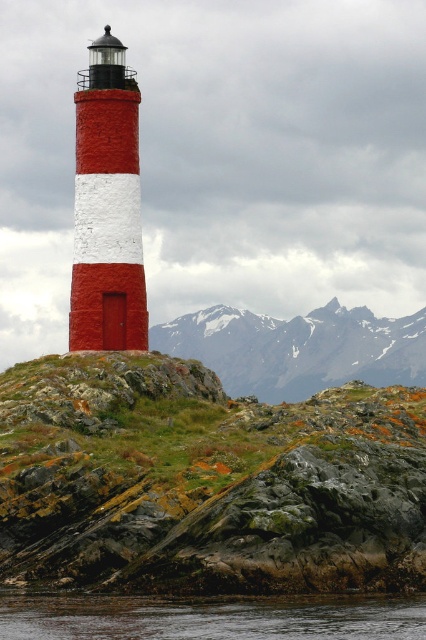
You are standing at the base of the lighthouse and want to place a small weatherproof box on the green mossy rock at center. Given that the coordinates of the rock are point (204, 481), can you confirm if this location is suitable for placing the box?

The green mossy rock at center is represented by point (204, 481), so yes, the location is suitable for placing the box as it is clearly marked in the scene.

In the scene shown: You are a hiker planning to climb the snowy rocky mountain at upper center and then descend to the transparent water at lower center. Which part of the journey will require more physical effort?

Climbing the snowy rocky mountain at upper center will require more physical effort because it has a greater height compared to the transparent water at lower center.

You are standing at the base of the lighthouse looking out towards the rocky terrain. There are two points marked in the scene. The first point is at coordinates point (34,433) and the second is at point (411,632). Which point is closer to your current position?

Point (34,433) is closer to your current position because it is further to the camera than point (411,632), meaning it is physically nearer to the observer standing at the base of the lighthouse.